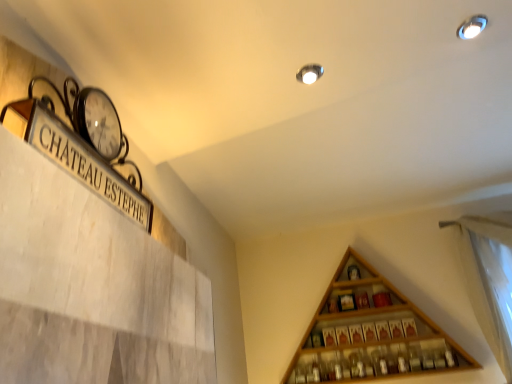
Identify the location of wooden triangle at lower right. The height and width of the screenshot is (384, 512). (370, 333).

Image resolution: width=512 pixels, height=384 pixels. What do you see at coordinates (370, 333) in the screenshot?
I see `wooden triangle at lower right` at bounding box center [370, 333].

This screenshot has height=384, width=512. What are the coordinates of `wooden triangle at lower right` in the screenshot? It's located at (370, 333).